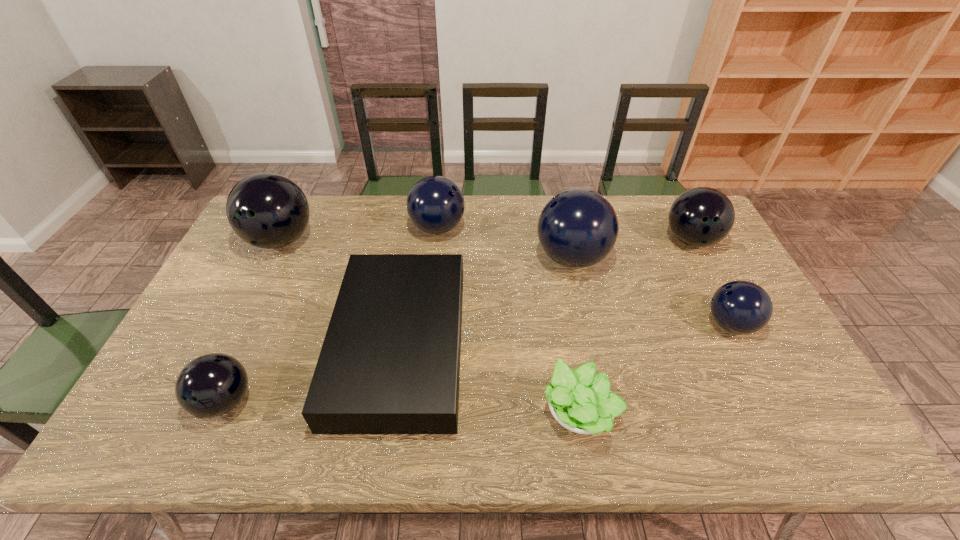
The image size is (960, 540). What are the coordinates of `CD player` in the screenshot? It's located at (390, 362).

Image resolution: width=960 pixels, height=540 pixels. I want to click on green lettuce, so click(x=581, y=401).

Where is `blank area located 0.220m on the surface of the second blue bowling ball from right to left near the finger holes`? Image resolution: width=960 pixels, height=540 pixels. blank area located 0.220m on the surface of the second blue bowling ball from right to left near the finger holes is located at coordinates (466, 258).

This screenshot has width=960, height=540. Find the location of `vacant area situated 0.250m on the surface of the second blue bowling ball from right to left near the finger holes`. vacant area situated 0.250m on the surface of the second blue bowling ball from right to left near the finger holes is located at coordinates (x=456, y=258).

Where is `free space located on the surface of the second blue bowling ball from right to left near the finger holes`? This screenshot has height=540, width=960. free space located on the surface of the second blue bowling ball from right to left near the finger holes is located at coordinates (475, 258).

Identify the location of vacant space located on the side of the biggest black bowling ball with the finger holes. (262, 278).

Where is `free space located on the surface of the leftmost blue bowling ball near the finger holes`? The width and height of the screenshot is (960, 540). free space located on the surface of the leftmost blue bowling ball near the finger holes is located at coordinates (532, 228).

This screenshot has height=540, width=960. Find the location of `free location located on the side of the rightmost black bowling ball with the finger holes`. free location located on the side of the rightmost black bowling ball with the finger holes is located at coordinates (735, 326).

This screenshot has height=540, width=960. I want to click on vacant space situated on the surface of the rightmost blue bowling ball near the finger holes, so click(x=570, y=325).

Find the location of `free region located 0.270m on the surface of the rightmost blue bowling ball near the finger holes`. free region located 0.270m on the surface of the rightmost blue bowling ball near the finger holes is located at coordinates (607, 325).